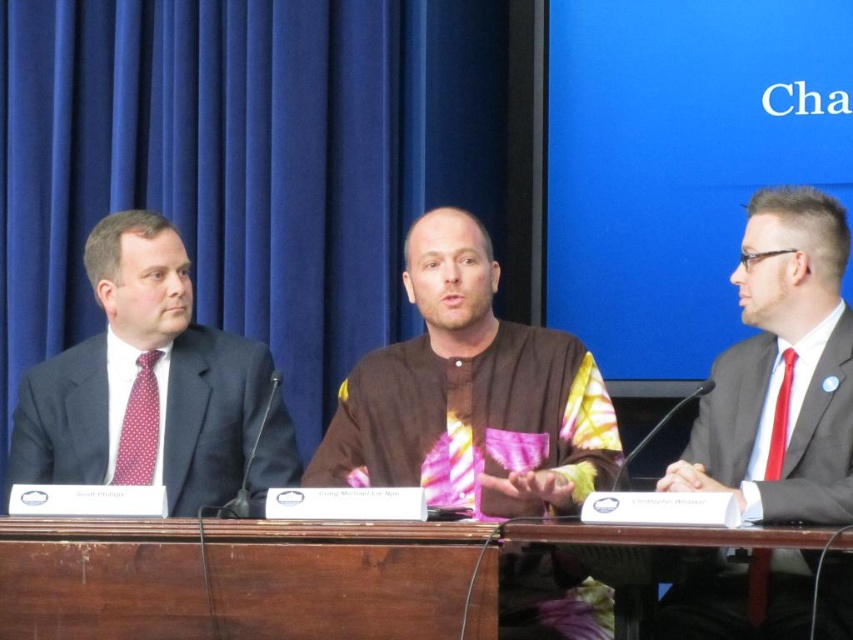
Is dark gray suit at left to the left of red silk tie at right from the viewer's perspective?

Indeed, dark gray suit at left is positioned on the left side of red silk tie at right.

Can you confirm if dark gray suit at left is wider than red silk tie at right?

Yes, dark gray suit at left is wider than red silk tie at right.

Between point (219, 413) and point (784, 419), which one is positioned behind?

The point (219, 413) is behind.

Identify the location of dark gray suit at left. The image size is (853, 640). (154, 387).

Image resolution: width=853 pixels, height=640 pixels. What do you see at coordinates (154, 387) in the screenshot? I see `dark gray suit at left` at bounding box center [154, 387].

Who is higher up, dark gray suit at left or polka dot silk tie at left?

Positioned higher is dark gray suit at left.

You are a GUI agent. You are given a task and a screenshot of the screen. Output one action in this format:
    pyautogui.click(x=<x>, y=<y>)
    Task: Click on the dark gray suit at left
    The width and height of the screenshot is (853, 640).
    Given the screenshot: What is the action you would take?
    pyautogui.click(x=154, y=387)

Who is lower down, brown wooden table at center or wooden at center?

brown wooden table at center is below.

Does point (488, 580) come farther from viewer compared to point (769, 608)?

That is False.

Find the location of a particular element. This screenshot has width=853, height=640. brown wooden table at center is located at coordinates (231, 579).